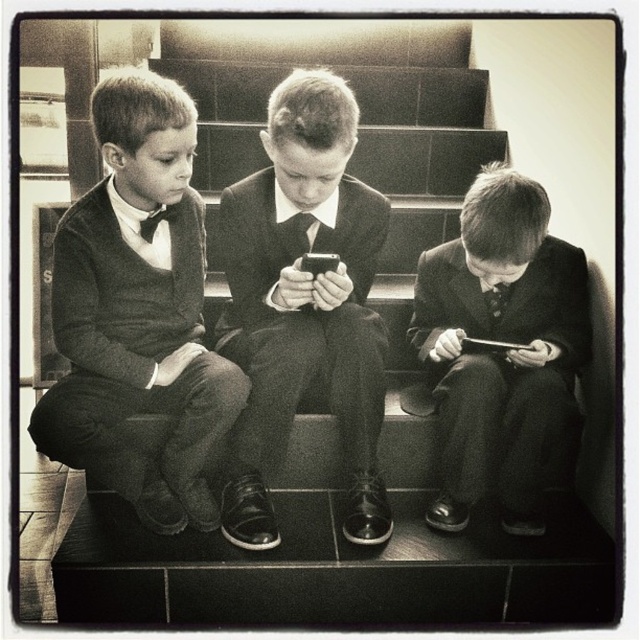
At what (x,y) coordinates should I click in order to perform the action: click on smooth black suit at center. Please return your answer as a coordinate pair (x, y). The image size is (640, 640). Looking at the image, I should click on (304, 305).

Is point (340, 326) more distant than point (300, 259)?

Yes, point (340, 326) is behind point (300, 259).

At what (x,y) coordinates should I click in order to perform the action: click on smooth black suit at center. Please return your answer as a coordinate pair (x, y). This screenshot has height=640, width=640. Looking at the image, I should click on (304, 305).

Is smooth suit at center to the left of black matte smartphone at center from the viewer's perspective?

In fact, smooth suit at center is to the right of black matte smartphone at center.

Between smooth suit at center and black matte smartphone at center, which one has less height?

black matte smartphone at center is shorter.

Which is in front, point (513, 202) or point (307, 259)?

Point (307, 259) is in front.

I want to click on smooth suit at center, so click(x=500, y=349).

Does smooth black suit at center lie in front of smooth suit at center?

Yes.

Is smooth black suit at center taller than smooth suit at center?

Correct, smooth black suit at center is much taller as smooth suit at center.

Who is more forward, (237, 545) or (484, 317)?

Point (237, 545) is more forward.

Where is `smooth black suit at center`? Image resolution: width=640 pixels, height=640 pixels. smooth black suit at center is located at coordinates (304, 305).